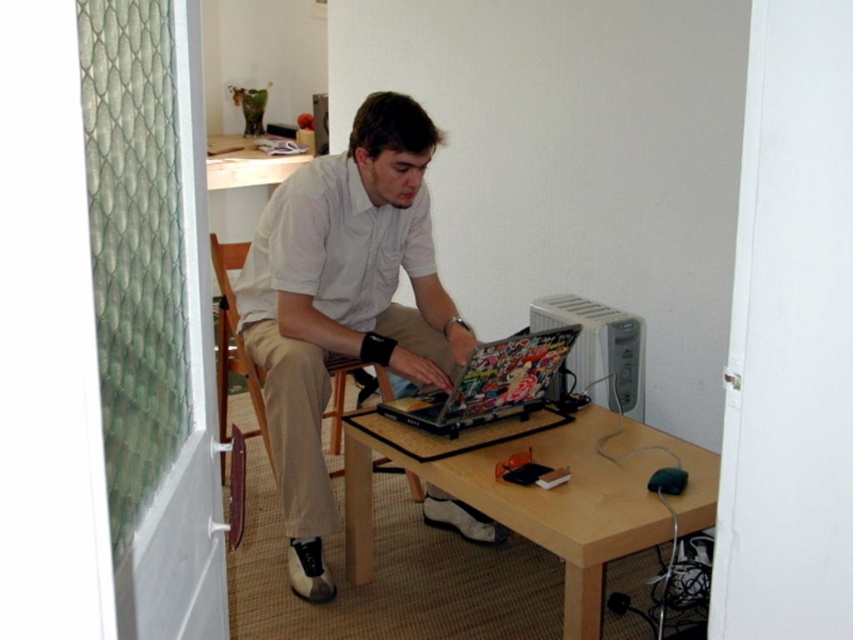
How distant is light beige cotton shirt at center from light brown wood table at center?

The distance of light beige cotton shirt at center from light brown wood table at center is 47.54 centimeters.

Consider the image. Is light beige cotton shirt at center smaller than light brown wood table at center?

No, light beige cotton shirt at center is not smaller than light brown wood table at center.

At what (x,y) coordinates should I click in order to perform the action: click on light beige cotton shirt at center. Please return your answer as a coordinate pair (x, y). Looking at the image, I should click on (343, 301).

Identify the location of light beige cotton shirt at center. (343, 301).

Is point (643, 436) positioned behind point (509, 401)?

No, (643, 436) is in front of (509, 401).

Is light brown wood table at center to the left of shiny plastic laptop at center from the viewer's perspective?

Correct, you'll find light brown wood table at center to the left of shiny plastic laptop at center.

What do you see at coordinates (548, 496) in the screenshot? I see `light brown wood table at center` at bounding box center [548, 496].

Image resolution: width=853 pixels, height=640 pixels. In order to click on light brown wood table at center in this screenshot , I will do (548, 496).

Is point (436, 406) behind point (230, 426)?

No, it is in front of (230, 426).

Does shiny plastic laptop at center appear on the left side of wooden chair at center?

Incorrect, shiny plastic laptop at center is not on the left side of wooden chair at center.

You are a GUI agent. You are given a task and a screenshot of the screen. Output one action in this format:
    pyautogui.click(x=<x>, y=<y>)
    Task: Click on the shiny plastic laptop at center
    This screenshot has height=640, width=853.
    Given the screenshot: What is the action you would take?
    pyautogui.click(x=490, y=385)